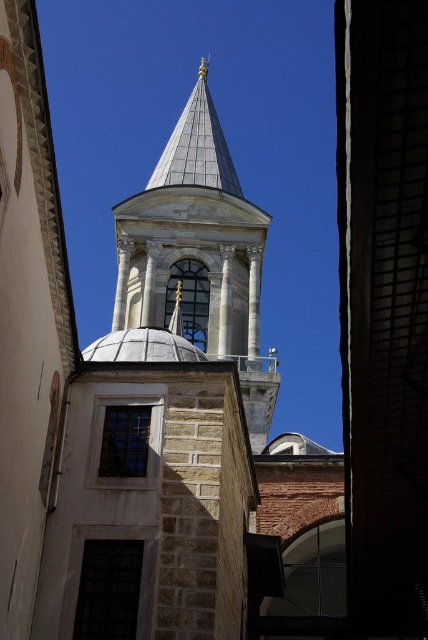
Question: Is white stone tower at center smaller than white marble dome at center?

Choices:
 (A) no
 (B) yes

Answer: (A)

Question: Which point is closer to the camera?

Choices:
 (A) white marble dome at center
 (B) white stone tower at center

Answer: (A)

Question: Which point is closer to the camera?

Choices:
 (A) white stone tower at center
 (B) white marble dome at center

Answer: (B)

Question: Among these objects, which one is farthest from the camera?

Choices:
 (A) white marble dome at center
 (B) white stone tower at center

Answer: (B)

Question: Is white stone tower at center bigger than white marble dome at center?

Choices:
 (A) yes
 (B) no

Answer: (A)

Question: Can you confirm if white stone tower at center is thinner than white marble dome at center?

Choices:
 (A) yes
 (B) no

Answer: (B)